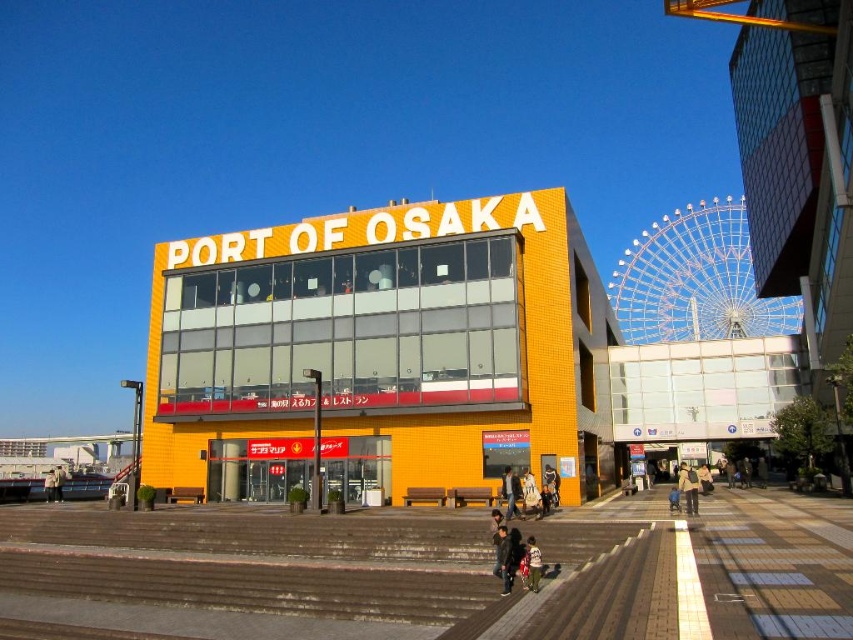
In the scene shown: Can you confirm if light brown fabric pants at center is thinner than light beige jacket at center?

Yes.

Between point (526, 538) and point (48, 477), which one is positioned in front?

Point (526, 538) is in front.

Identify the location of light brown fabric pants at center. The image size is (853, 640). (532, 563).

Is dark gray jacket at center in front of light brown fabric pants at center?

No, it is not.

What do you see at coordinates (506, 556) in the screenshot? The width and height of the screenshot is (853, 640). I see `dark gray jacket at center` at bounding box center [506, 556].

I want to click on dark gray jacket at center, so click(506, 556).

Does light brown leather jacket at center come behind light beige jacket at center?

No, light brown leather jacket at center is in front of light beige jacket at center.

Can you confirm if light brown leather jacket at center is positioned above light beige jacket at center?

Correct, light brown leather jacket at center is located above light beige jacket at center.

Does point (688, 513) lie in front of point (51, 492)?

Yes, it is in front of point (51, 492).

Find the location of a particular element. The width and height of the screenshot is (853, 640). light brown leather jacket at center is located at coordinates (688, 486).